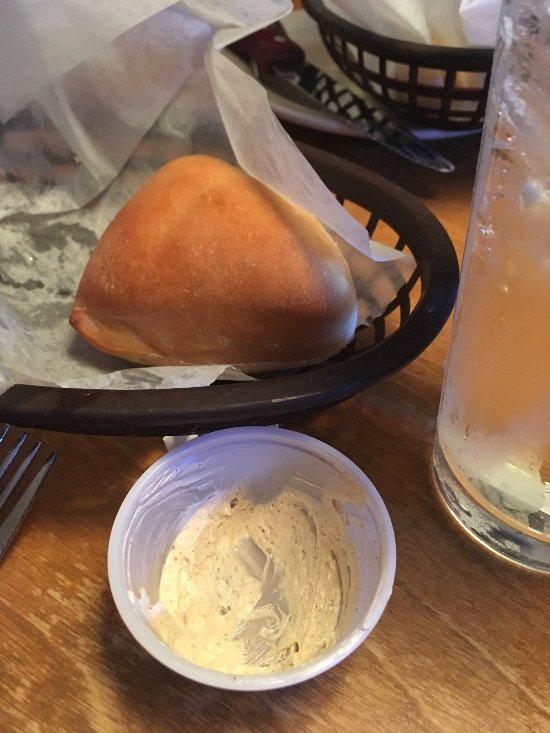
Find the location of a particular element. The height and width of the screenshot is (733, 550). cup is located at coordinates tap(381, 583).